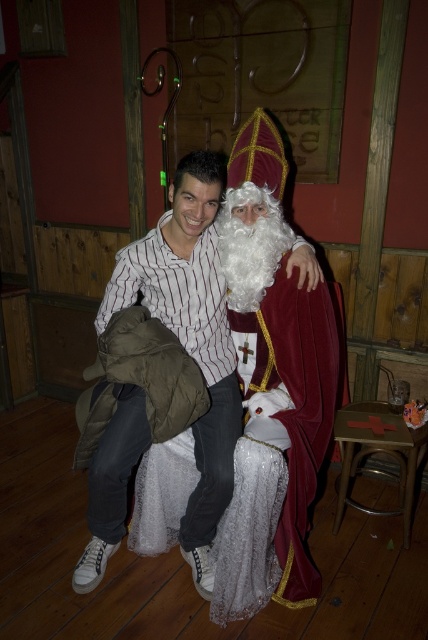
Question: Can you confirm if velvet maroon robe at center is positioned below white striped shirt at center?

Choices:
 (A) yes
 (B) no

Answer: (B)

Question: Does velvet maroon robe at center appear on the left side of wooden stool at lower right?

Choices:
 (A) yes
 (B) no

Answer: (A)

Question: Which point appears farthest from the camera in this image?

Choices:
 (A) (258, 147)
 (B) (383, 413)

Answer: (B)

Question: Which object is closer to the camera taking this photo?

Choices:
 (A) velvet maroon robe at center
 (B) wooden stool at lower right
 (C) white striped shirt at center

Answer: (C)

Question: Among these objects, which one is farthest from the camera?

Choices:
 (A) white striped shirt at center
 (B) velvet maroon robe at center
 (C) wooden stool at lower right

Answer: (C)

Question: Does velvet maroon robe at center appear over wooden stool at lower right?

Choices:
 (A) no
 (B) yes

Answer: (B)